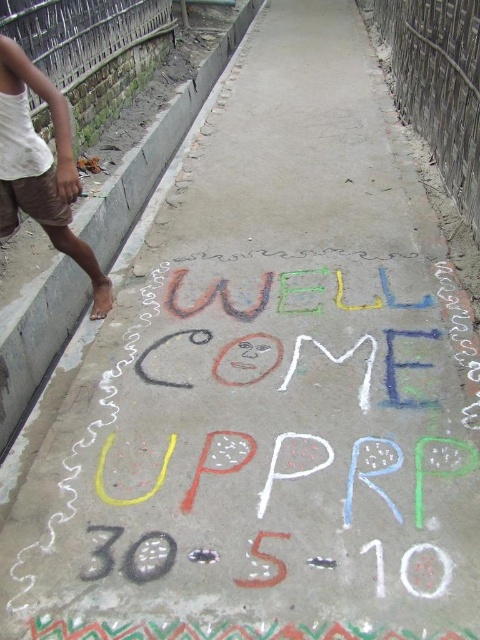
Can you confirm if gray concrete curb at lower left is wider than brown cotton shorts at left?

Yes.

Is point (37, 323) closer to viewer compared to point (31, 122)?

No, (37, 323) is further to viewer.

Where is `gray concrete curb at lower left`? Image resolution: width=480 pixels, height=640 pixels. gray concrete curb at lower left is located at coordinates (x=38, y=365).

Locate an element on the screen. Image resolution: width=480 pixels, height=640 pixels. gray concrete curb at lower left is located at coordinates (38, 365).